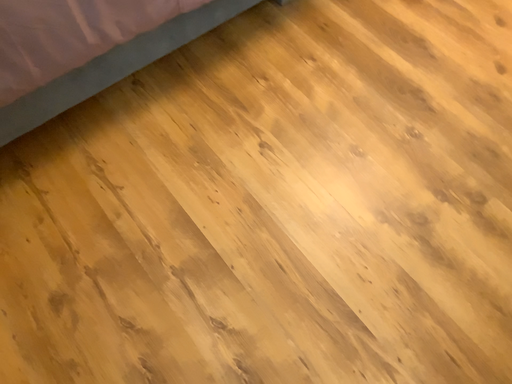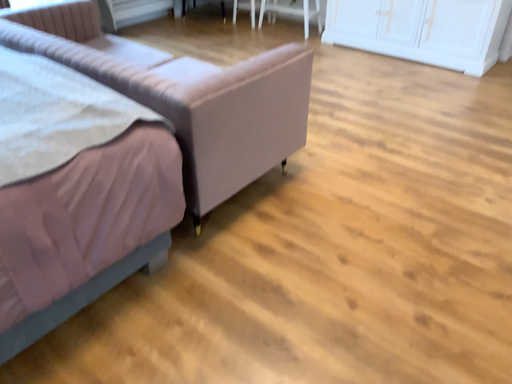
Question: Which way did the camera rotate in the video?

Choices:
 (A) rotated downward
 (B) rotated upward

Answer: (B)